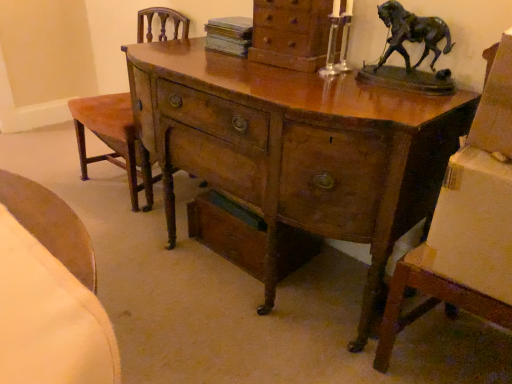
At what (x,y) coordinates should I click in order to perform the action: click on vacant space situated above wooden desk at center (from a real-world perspective). Please return your answer as a coordinate pair (x, y). Looking at the image, I should click on (256, 72).